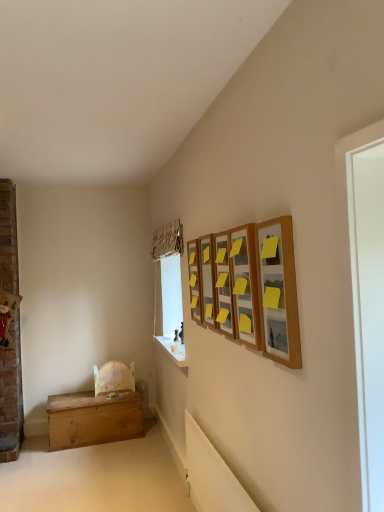
Question: Considering the relative positions of white smooth window sill at lower center and wooden picture frame at upper right, the 2th picture frame viewed from the front, in the image provided, is white smooth window sill at lower center to the left of wooden picture frame at upper right, the 2th picture frame viewed from the front, from the viewer's perspective?

Choices:
 (A) yes
 (B) no

Answer: (A)

Question: From a real-world perspective, is white smooth window sill at lower center on top of wooden picture frame at upper right, which ranks as the 4th picture frame in back-to-front order?

Choices:
 (A) no
 (B) yes

Answer: (A)

Question: Is white smooth window sill at lower center smaller than wooden picture frame at upper right, which ranks as the 4th picture frame in back-to-front order?

Choices:
 (A) no
 (B) yes

Answer: (A)

Question: Considering the relative sizes of white smooth window sill at lower center and wooden picture frame at upper right, the 2th picture frame viewed from the front, in the image provided, is white smooth window sill at lower center wider than wooden picture frame at upper right, the 2th picture frame viewed from the front,?

Choices:
 (A) no
 (B) yes

Answer: (B)

Question: Is white smooth window sill at lower center not within wooden picture frame at upper right, the 2th picture frame viewed from the front?

Choices:
 (A) yes
 (B) no

Answer: (A)

Question: Is wooden picture frame at upper right, the second picture frame from the back, inside or outside of wooden picture frame at upper right, the 2th picture frame viewed from the front?

Choices:
 (A) outside
 (B) inside

Answer: (A)

Question: Would you say wooden picture frame at upper right, which is the 4th picture frame from front to back, is to the left or to the right of wooden picture frame at upper right, which ranks as the 4th picture frame in back-to-front order, in the picture?

Choices:
 (A) right
 (B) left

Answer: (B)

Question: Is point [x=210, y=285] positioned closer to the camera than point [x=253, y=246]?

Choices:
 (A) farther
 (B) closer

Answer: (A)

Question: Relative to wooden picture frame at upper right, which ranks as the 4th picture frame in back-to-front order, is wooden picture frame at upper right, which is the 4th picture frame from front to back, in front or behind?

Choices:
 (A) behind
 (B) front

Answer: (A)

Question: Relative to wooden picture frame at upper center, marked as the 1th picture frame in a back-to-front arrangement, is wooden chest at lower left in front or behind?

Choices:
 (A) behind
 (B) front

Answer: (A)

Question: From the image's perspective, relative to wooden picture frame at upper center, the fifth picture frame positioned from the front, is wooden chest at lower left above or below?

Choices:
 (A) above
 (B) below

Answer: (B)

Question: Is point (114, 431) positioned closer to the camera than point (190, 264)?

Choices:
 (A) closer
 (B) farther

Answer: (B)

Question: From a real-world perspective, is wooden chest at lower left above or below wooden picture frame at upper center, the fifth picture frame positioned from the front?

Choices:
 (A) below
 (B) above

Answer: (A)

Question: Is wooden picture frame at upper right, the 2th picture frame viewed from the front, situated inside wooden chest at lower left or outside?

Choices:
 (A) outside
 (B) inside

Answer: (A)

Question: Based on their positions, is wooden picture frame at upper right, the 2th picture frame viewed from the front, located to the left or right of wooden chest at lower left?

Choices:
 (A) right
 (B) left

Answer: (A)